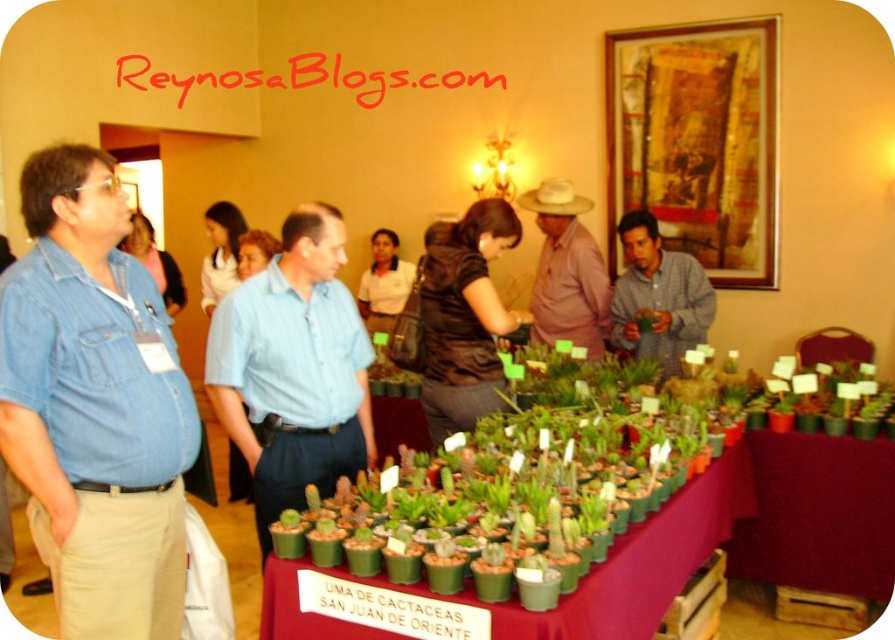
Question: Which point is closer to the camera?

Choices:
 (A) light blue shirt at center
 (B) maroon fabric table at lower right
 (C) denim shirt at left
 (D) green matte shirt at center

Answer: (C)

Question: Is green plastic pots at center thinner than pink cotton shirt at center?

Choices:
 (A) no
 (B) yes

Answer: (A)

Question: Considering the relative positions of denim shirt at left and maroon fabric table at lower right in the image provided, where is denim shirt at left located with respect to maroon fabric table at lower right?

Choices:
 (A) below
 (B) above

Answer: (B)

Question: Which object is farther from the camera taking this photo?

Choices:
 (A) light blue shirt at center
 (B) green matte shirt at center
 (C) pink cotton shirt at center
 (D) green plastic pots at center

Answer: (C)

Question: Which of the following is the farthest from the observer?

Choices:
 (A) denim shirt at left
 (B) maroon fabric table at lower right

Answer: (B)

Question: Observing the image, what is the correct spatial positioning of denim shirt at left in reference to green plastic pots at center?

Choices:
 (A) below
 (B) above

Answer: (B)